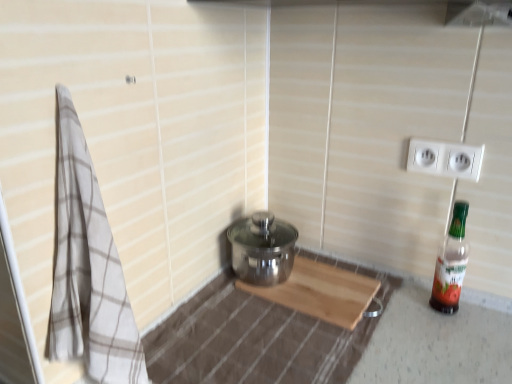
Question: Is beige checkered towel at left at the right side of translucent plastic bottle at right?

Choices:
 (A) no
 (B) yes

Answer: (A)

Question: From the image's perspective, is beige checkered towel at left above translucent plastic bottle at right?

Choices:
 (A) yes
 (B) no

Answer: (A)

Question: From a real-world perspective, is beige checkered towel at left positioned under translucent plastic bottle at right based on gravity?

Choices:
 (A) no
 (B) yes

Answer: (A)

Question: Could you tell me if beige checkered towel at left is turned towards translucent plastic bottle at right?

Choices:
 (A) yes
 (B) no

Answer: (B)

Question: Considering the relative sizes of beige checkered towel at left and translucent plastic bottle at right in the image provided, is beige checkered towel at left bigger than translucent plastic bottle at right?

Choices:
 (A) yes
 (B) no

Answer: (A)

Question: Can you confirm if beige checkered towel at left is thinner than translucent plastic bottle at right?

Choices:
 (A) yes
 (B) no

Answer: (B)

Question: Considering the relative sizes of translucent plastic bottle at right and white plastic electric outlet at upper right in the image provided, is translucent plastic bottle at right smaller than white plastic electric outlet at upper right?

Choices:
 (A) yes
 (B) no

Answer: (B)

Question: Considering the relative positions of translucent plastic bottle at right and white plastic electric outlet at upper right in the image provided, is translucent plastic bottle at right behind white plastic electric outlet at upper right?

Choices:
 (A) no
 (B) yes

Answer: (A)

Question: Could white plastic electric outlet at upper right be considered to be inside translucent plastic bottle at right?

Choices:
 (A) yes
 (B) no

Answer: (B)

Question: From the image's perspective, does translucent plastic bottle at right appear lower than white plastic electric outlet at upper right?

Choices:
 (A) yes
 (B) no

Answer: (A)

Question: Is translucent plastic bottle at right oriented towards white plastic electric outlet at upper right?

Choices:
 (A) yes
 (B) no

Answer: (B)

Question: From a real-world perspective, is translucent plastic bottle at right located beneath white plastic electric outlet at upper right?

Choices:
 (A) yes
 (B) no

Answer: (A)

Question: From a real-world perspective, is beige checkered towel at left located higher than white plastic electric outlet at upper right?

Choices:
 (A) no
 (B) yes

Answer: (A)